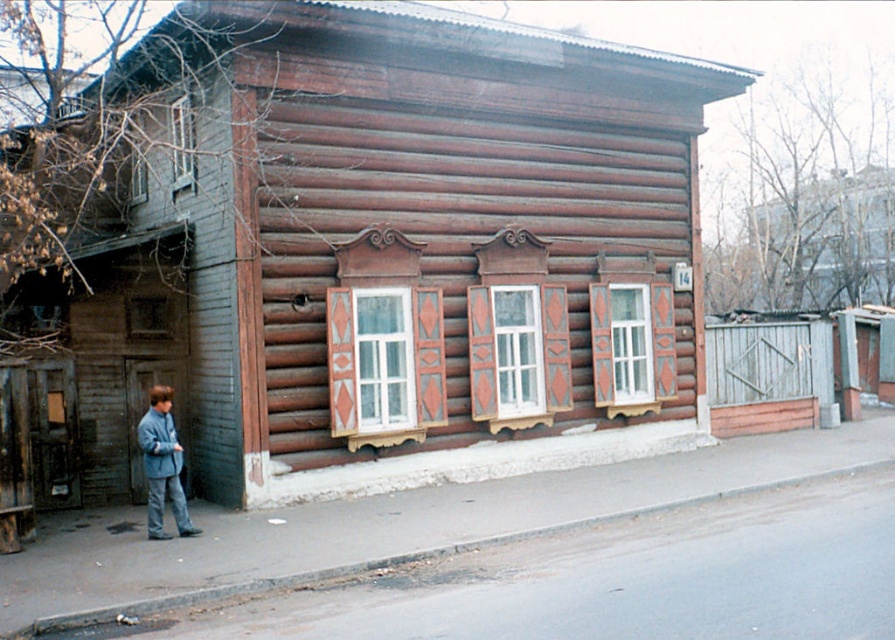
Does gray concrete curb at lower center have a smaller size compared to light blue fabric jacket at lower left?

No, gray concrete curb at lower center is not smaller than light blue fabric jacket at lower left.

Is gray concrete curb at lower center below light blue fabric jacket at lower left?

Yes, gray concrete curb at lower center is below light blue fabric jacket at lower left.

Describe the element at coordinates (425, 552) in the screenshot. Image resolution: width=895 pixels, height=640 pixels. I see `gray concrete curb at lower center` at that location.

Find the location of a particular element. The image size is (895, 640). gray concrete curb at lower center is located at coordinates (425, 552).

Is brown wooden hut at center to the left of gray concrete curb at lower center from the viewer's perspective?

Yes, brown wooden hut at center is to the left of gray concrete curb at lower center.

Is brown wooden hut at center wider than gray concrete curb at lower center?

Yes.

Describe the element at coordinates (378, 252) in the screenshot. I see `brown wooden hut at center` at that location.

Find the location of a particular element. This screenshot has width=895, height=640. brown wooden hut at center is located at coordinates (378, 252).

In the scene shown: Is wooden fence at upper right to the left of gray concrete curb at lower center from the viewer's perspective?

No, wooden fence at upper right is not to the left of gray concrete curb at lower center.

Consider the image. Is wooden fence at upper right wider than gray concrete curb at lower center?

No.

The height and width of the screenshot is (640, 895). What do you see at coordinates (825, 240) in the screenshot?
I see `wooden fence at upper right` at bounding box center [825, 240].

Locate an element on the screen. The image size is (895, 640). wooden fence at upper right is located at coordinates (825, 240).